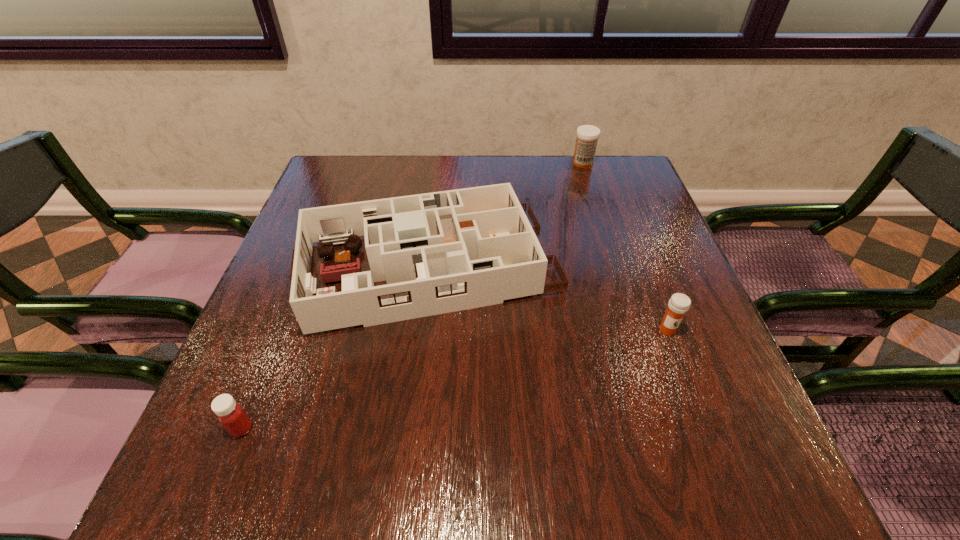
The width and height of the screenshot is (960, 540). I want to click on free point at the far right corner, so click(x=592, y=190).

Image resolution: width=960 pixels, height=540 pixels. In order to click on empty location between the nearest object and the dollhouse in this screenshot , I will do `click(335, 348)`.

This screenshot has width=960, height=540. What are the coordinates of `vacant point located between the third object from left to right and the rightmost object` in the screenshot? It's located at (625, 247).

This screenshot has width=960, height=540. I want to click on vacant point located between the leftmost medicine and the rightmost object, so click(x=454, y=379).

You are a GUI agent. You are given a task and a screenshot of the screen. Output one action in this format:
    pyautogui.click(x=<x>, y=<y>)
    Task: Click on the vacant area that lies between the second farthest medicine and the dollhouse
    
    Given the screenshot: What is the action you would take?
    pyautogui.click(x=548, y=299)

At what (x,y) coordinates should I click in order to perform the action: click on free spot between the rightmost object and the nearest medicine. Please return your answer as a coordinate pair (x, y). Looking at the image, I should click on (454, 379).

The image size is (960, 540). In order to click on unoccupied area between the second nearest medicine and the farthest medicine in this screenshot , I will do `click(625, 247)`.

Select which object appears as the third closest to the second medicine from right to left. Please provide its 2D coordinates. Your answer should be formatted as a tuple, i.e. [(x, y)], where the tuple contains the x and y coordinates of a point satisfying the conditions above.

[(231, 415)]

Select which object is the third closest to the tallest medicine. Please provide its 2D coordinates. Your answer should be formatted as a tuple, i.e. [(x, y)], where the tuple contains the x and y coordinates of a point satisfying the conditions above.

[(231, 415)]

Locate which medicine ranks third in proximity to the dollhouse. Please provide its 2D coordinates. Your answer should be formatted as a tuple, i.e. [(x, y)], where the tuple contains the x and y coordinates of a point satisfying the conditions above.

[(587, 136)]